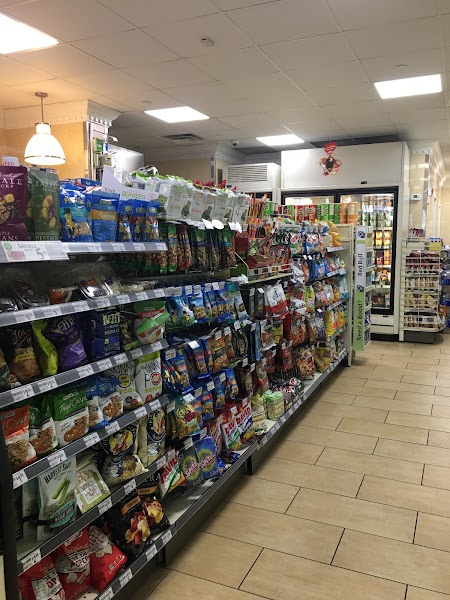
At what (x,y) coordinates should I click in order to perform the action: click on shelf. Please return your answer as a coordinate pair (x, y). The width and height of the screenshot is (450, 600). Looking at the image, I should click on pos(78,245), pos(67,308), pos(68,376), pos(75,447), pos(118,495), pos(192,510).